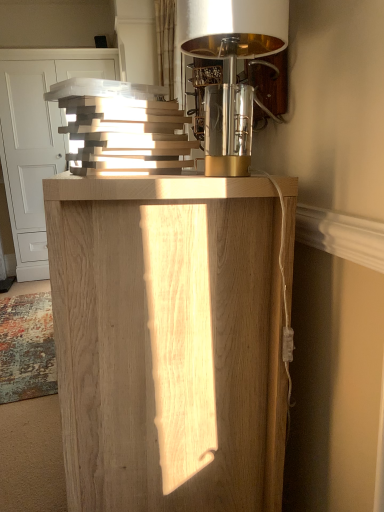
Question: Based on their sizes in the image, would you say natural wood cabinet at center is bigger or smaller than polished brass lampshade at upper right?

Choices:
 (A) big
 (B) small

Answer: (A)

Question: Does point (104, 385) appear closer or farther from the camera than point (241, 165)?

Choices:
 (A) farther
 (B) closer

Answer: (B)

Question: Which object is positioned closest to the natural wood cabinet at center?

Choices:
 (A) natural wood cabinet at upper left
 (B) polished brass lampshade at upper right

Answer: (B)

Question: Which of these objects is positioned closest to the natural wood cabinet at center?

Choices:
 (A) polished brass lampshade at upper right
 (B) natural wood cabinet at upper left

Answer: (A)